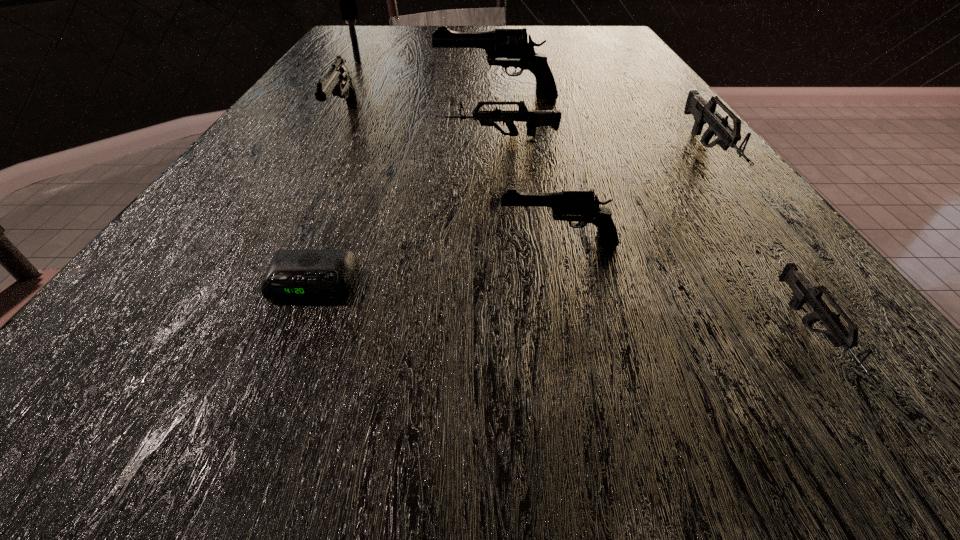
Where is `vacant space at the far edge of the desktop`? This screenshot has height=540, width=960. vacant space at the far edge of the desktop is located at coordinates (401, 43).

At what (x,y) coordinates should I click in order to perform the action: click on vacant point at the near edge. Please return your answer as a coordinate pair (x, y). Looking at the image, I should click on (759, 418).

I want to click on vacant space at the left edge of the desktop, so click(x=207, y=388).

You are a GUI agent. You are given a task and a screenshot of the screen. Output one action in this format:
    pyautogui.click(x=<x>, y=<y>)
    Task: Click on the vacant area at the right edge of the desktop
    The height and width of the screenshot is (540, 960).
    Given the screenshot: What is the action you would take?
    pyautogui.click(x=672, y=177)

What are the coordinates of `free location at the far right corner of the desktop` in the screenshot? It's located at (597, 36).

In order to click on empty space that is in between the leftmost grey gun and the second tallest gun in this screenshot , I will do `click(424, 129)`.

Find the location of a particular element. This screenshot has width=960, height=540. free space between the shortest object and the shortest gun is located at coordinates (563, 309).

Identify the location of vacant area that lies between the farthest object and the leftmost grey gun. (430, 99).

Find the location of a particular element. The height and width of the screenshot is (540, 960). free space between the biggest grey gun and the nearest gun is located at coordinates (761, 242).

Find the location of `free space that is in between the biggest grey gun and the second tallest object`. free space that is in between the biggest grey gun and the second tallest object is located at coordinates (603, 124).